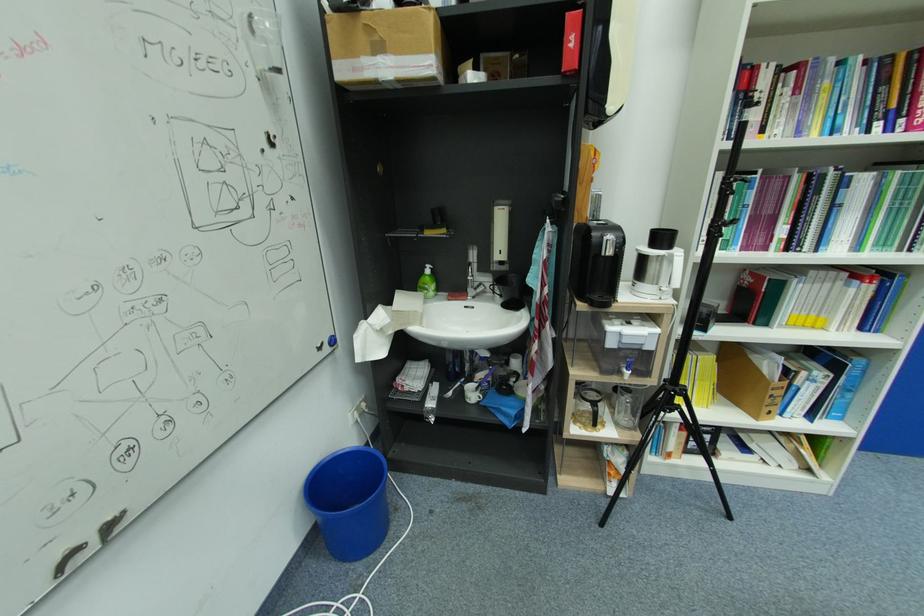
The width and height of the screenshot is (924, 616). What do you see at coordinates (613, 395) in the screenshot? I see `a glass pitcher handle` at bounding box center [613, 395].